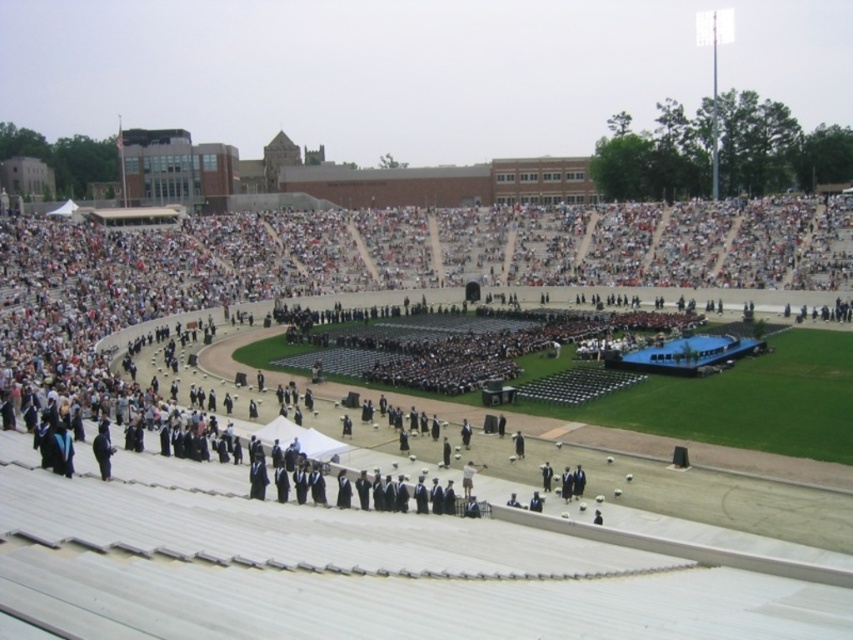
Which of these two, black graduation gown at center or black matte suit at lower left, stands taller?

black graduation gown at center is taller.

Which is behind, point (775, 445) or point (103, 433)?

The point (775, 445) is more distant.

Is point (131, 273) less distant than point (97, 464)?

No, (131, 273) is behind (97, 464).

Where is `black graduation gown at center`? Image resolution: width=853 pixels, height=640 pixels. black graduation gown at center is located at coordinates (169, 278).